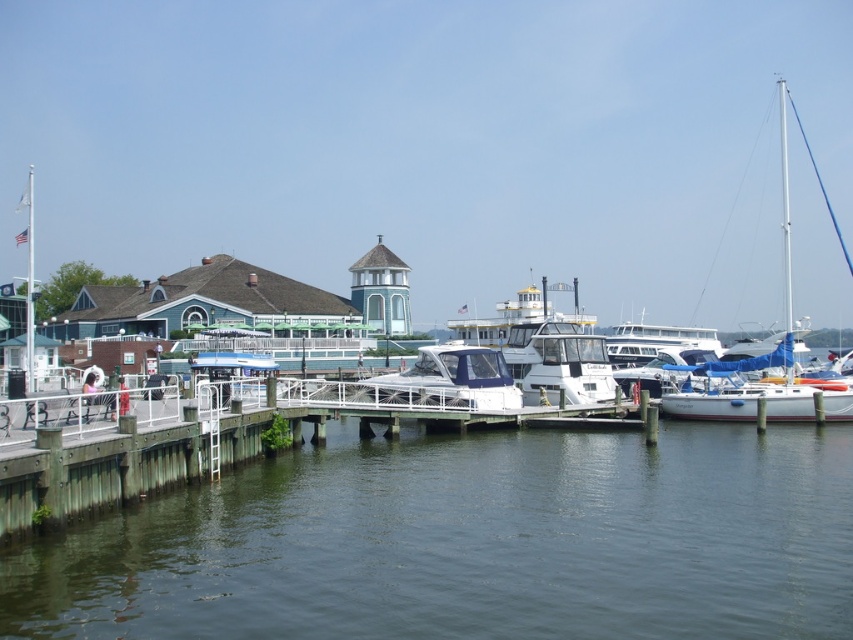
Question: Estimate the real-world distances between objects in this image. Which object is farther from the wooden dock at lower left?

Choices:
 (A) white matte sailboat at right
 (B) clear water at dock center

Answer: (A)

Question: Does clear water at dock center have a greater width compared to wooden dock at lower left?

Choices:
 (A) no
 (B) yes

Answer: (B)

Question: In this image, where is clear water at dock center located relative to white matte sailboat at right?

Choices:
 (A) below
 (B) above

Answer: (A)

Question: Which object is farther from the camera taking this photo?

Choices:
 (A) white matte sailboat at right
 (B) clear water at dock center
 (C) wooden dock at lower left

Answer: (A)

Question: Does clear water at dock center lie behind wooden dock at lower left?

Choices:
 (A) yes
 (B) no

Answer: (B)

Question: Which is nearer to the white matte sailboat at right?

Choices:
 (A) wooden dock at lower left
 (B) clear water at dock center

Answer: (B)